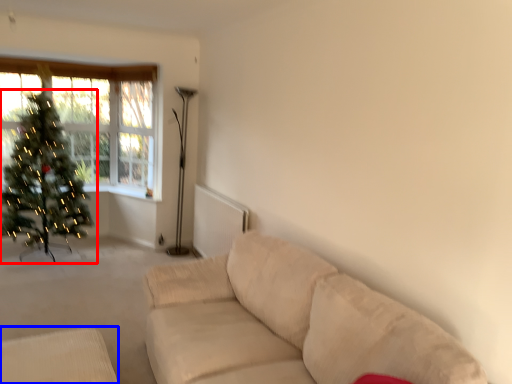
Question: Which object appears farthest to the camera in this image, christmas tree (highlighted by a red box) or furniture (highlighted by a blue box)?

Choices:
 (A) christmas tree
 (B) furniture

Answer: (A)